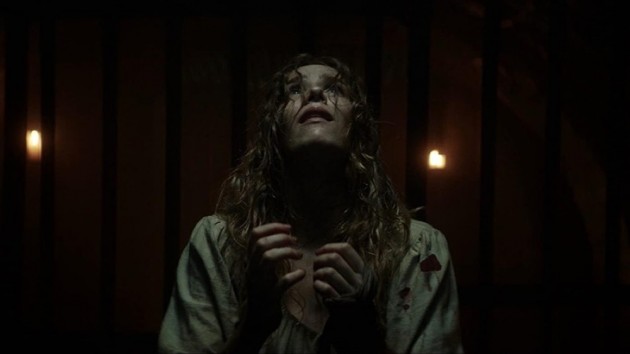
The width and height of the screenshot is (630, 354). Identify the location of light on right side. (438, 159).